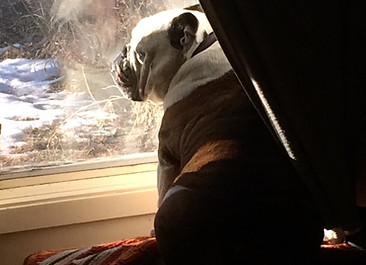
Locate an element on the screen. light reflection on window sill is located at coordinates (148, 178).